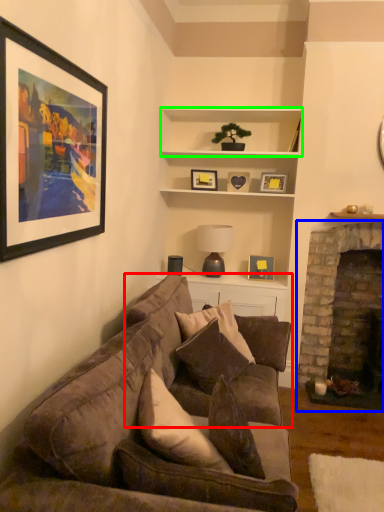
Question: Which is nearer to the studio couch (highlighted by a red box)? fireplace (highlighted by a blue box) or cabinet (highlighted by a green box).

Choices:
 (A) fireplace
 (B) cabinet

Answer: (A)